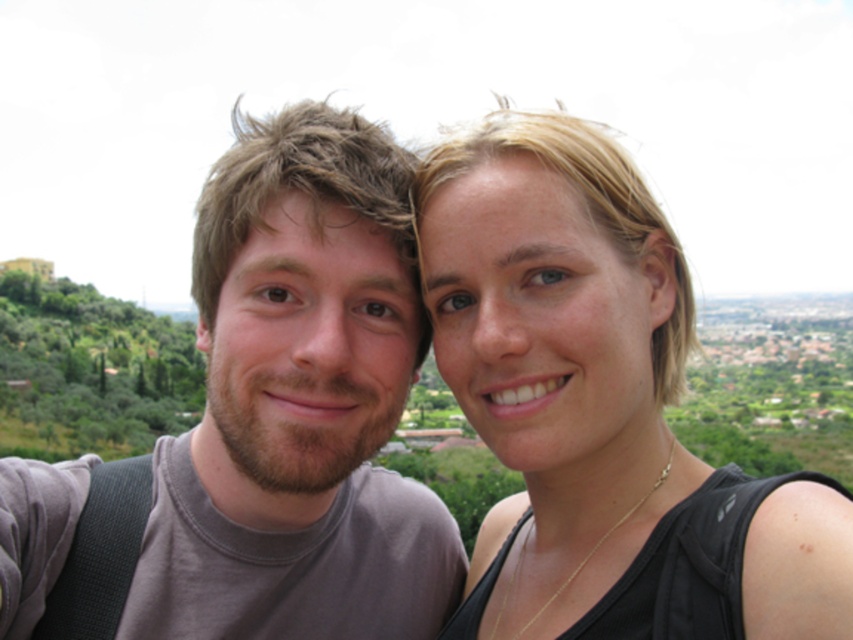
Question: Is matte black tank top at center thinner than gray matte t-shirt at center?

Choices:
 (A) no
 (B) yes

Answer: (B)

Question: Is matte black tank top at center positioned behind gray matte t-shirt at center?

Choices:
 (A) yes
 (B) no

Answer: (B)

Question: Is matte black tank top at center positioned at the back of gray matte t-shirt at center?

Choices:
 (A) no
 (B) yes

Answer: (A)

Question: Which object appears closest to the camera in this image?

Choices:
 (A) matte black tank top at center
 (B) gray matte t-shirt at center

Answer: (A)